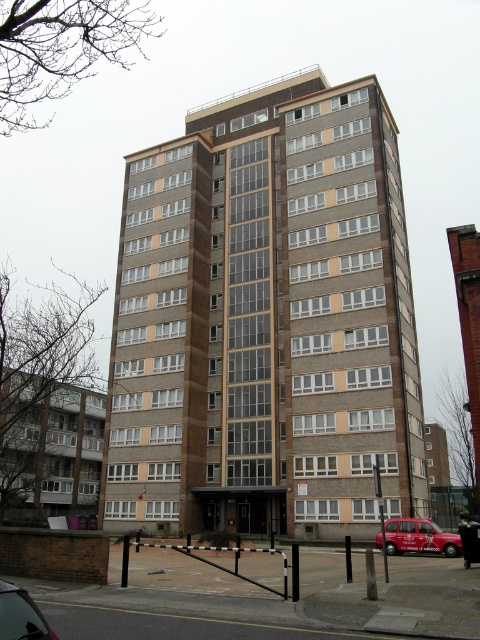
Consider the image. Between red matte taxi at lower right and metallic silver car at lower left, which one has less height?

metallic silver car at lower left

Is point (425, 548) behind point (20, 616)?

Yes, point (425, 548) is farther from viewer.

The image size is (480, 640). I want to click on red matte taxi at lower right, so click(417, 538).